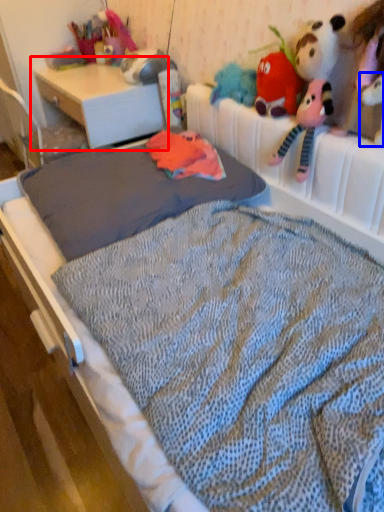
Question: Which object is closer to the camera taking this photo, desk (highlighted by a red box) or toy (highlighted by a blue box)?

Choices:
 (A) desk
 (B) toy

Answer: (B)